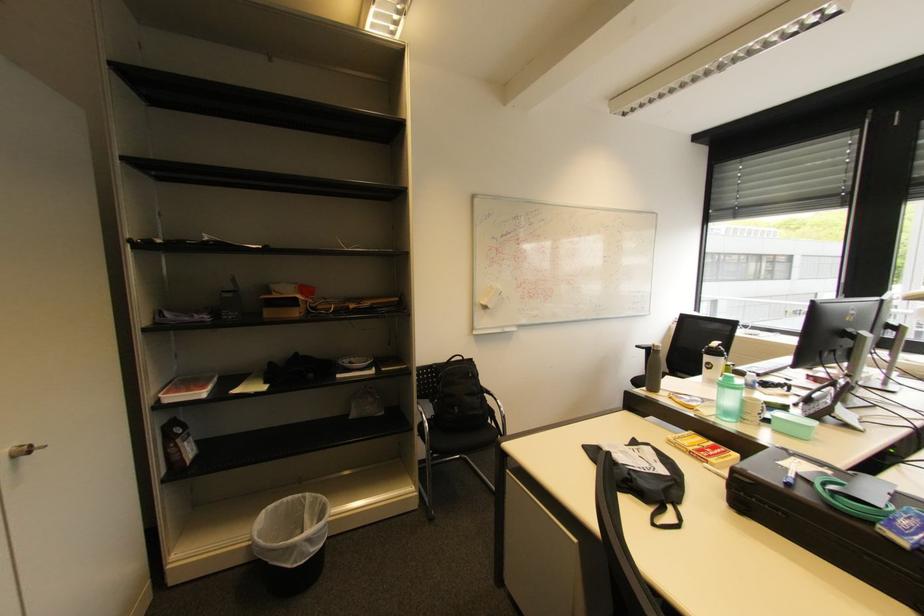
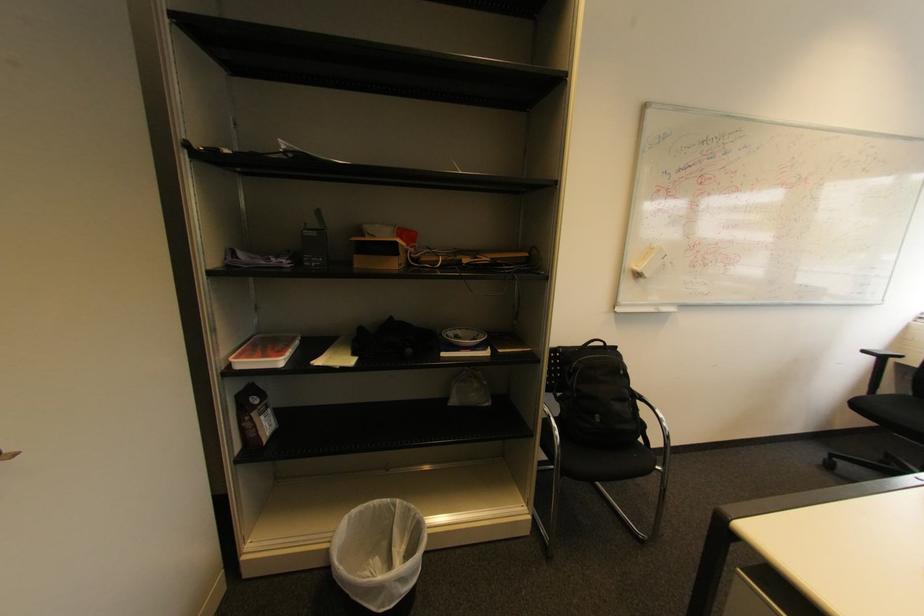
Find the pixel in the second image that matches pixel 490 309 in the first image.

(643, 276)